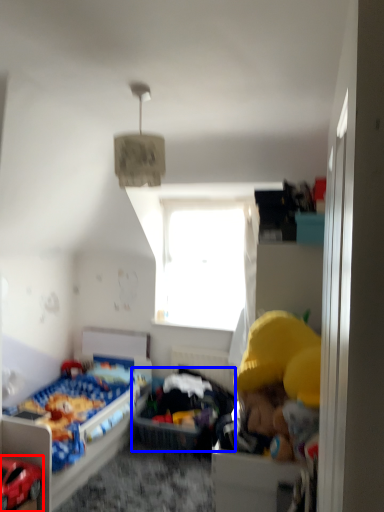
Question: Among these objects, which one is farthest to the camera, toy (highlighted by a red box) or infant bed (highlighted by a blue box)?

Choices:
 (A) toy
 (B) infant bed

Answer: (B)